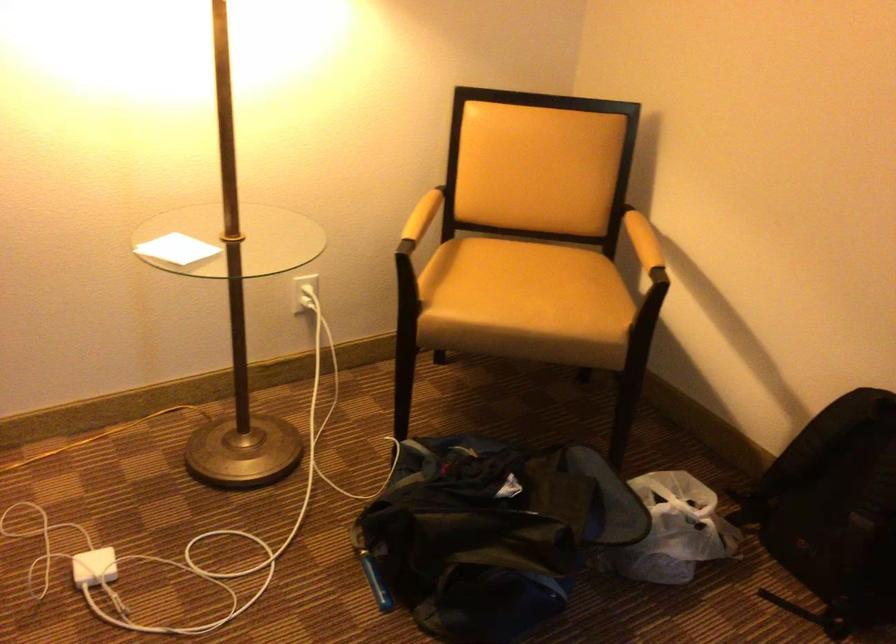
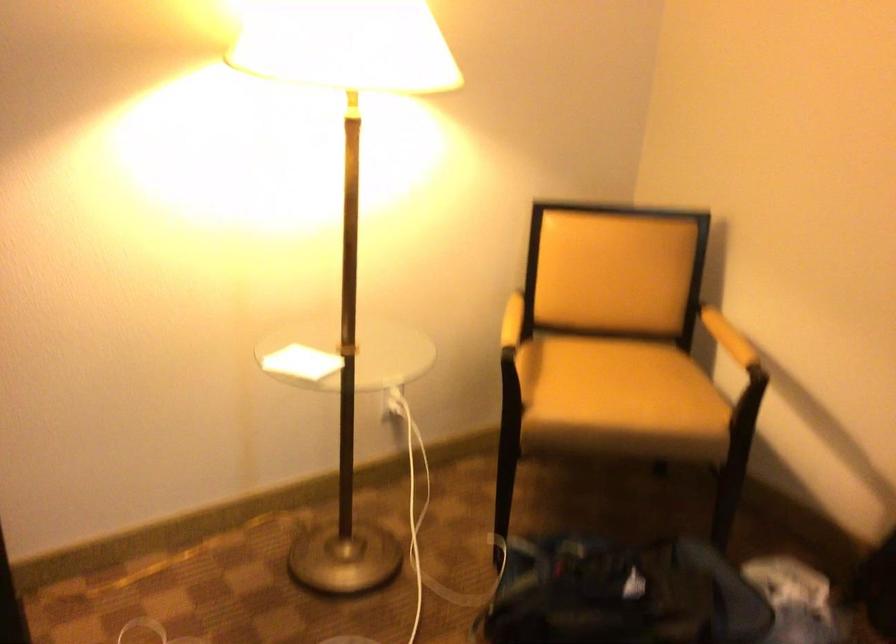
In the second image, find the point that corresponds to pixel 185 250 in the first image.

(300, 363)